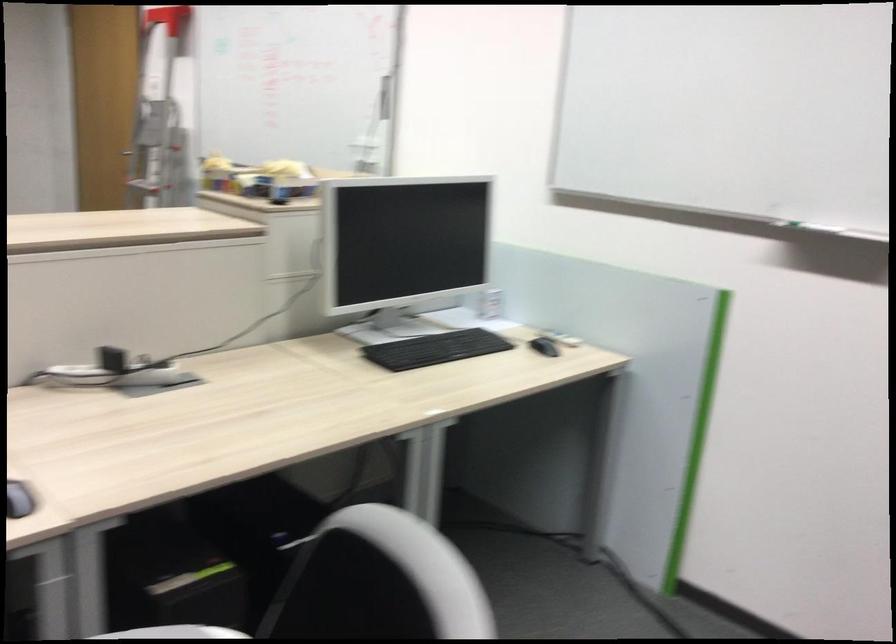
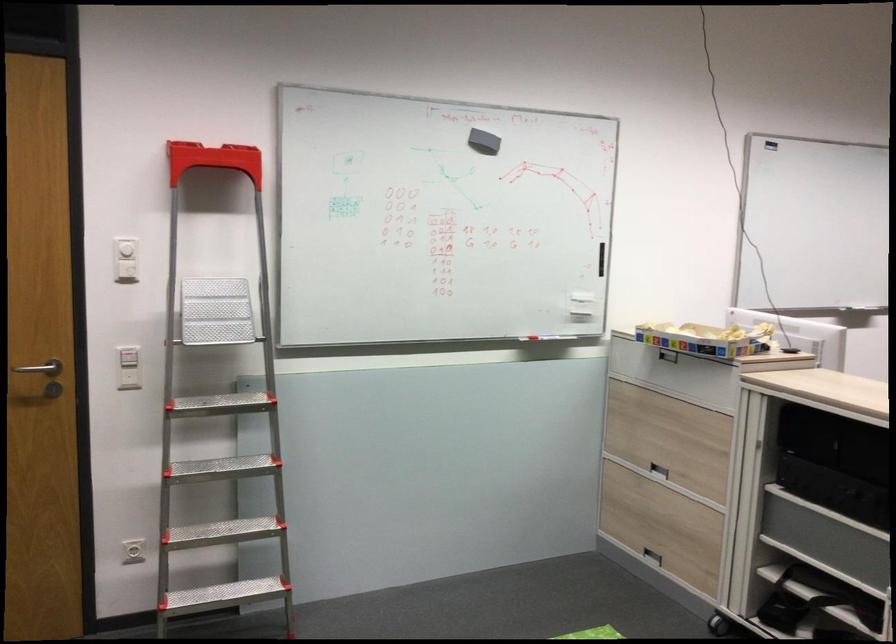
Locate, in the second image, the point that corresponds to [222,169] in the first image.

(705, 339)